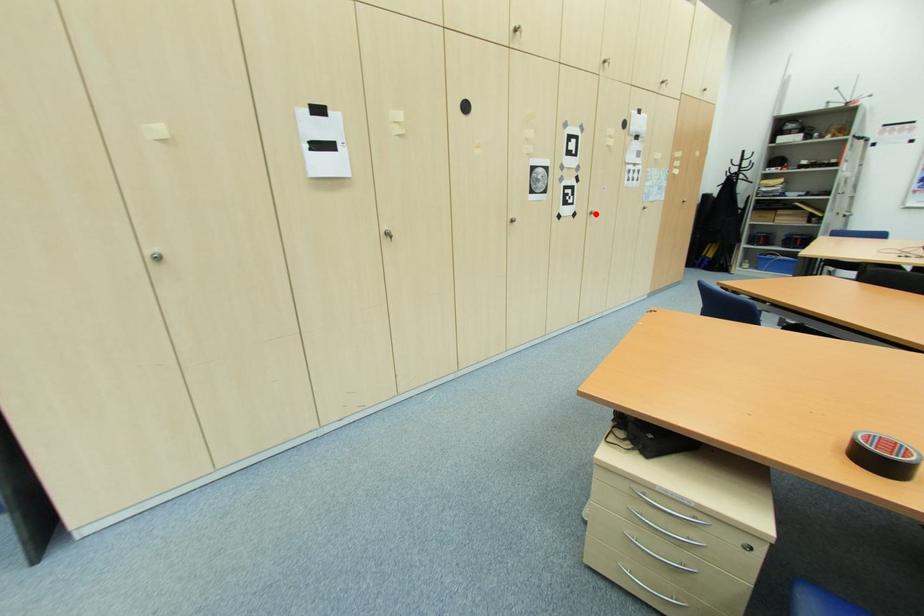
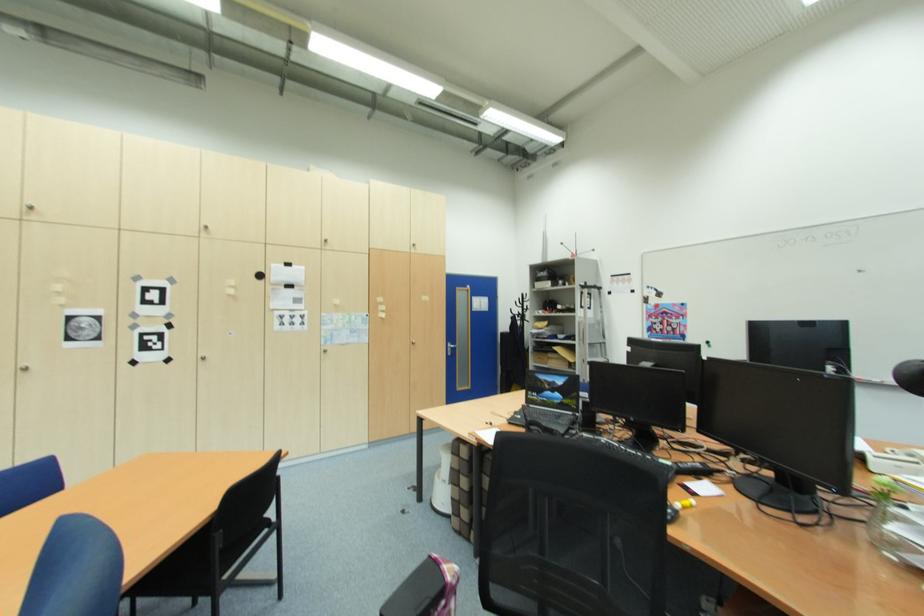
In the second image, find the point that corresponds to the highlighted location in the first image.

(208, 360)